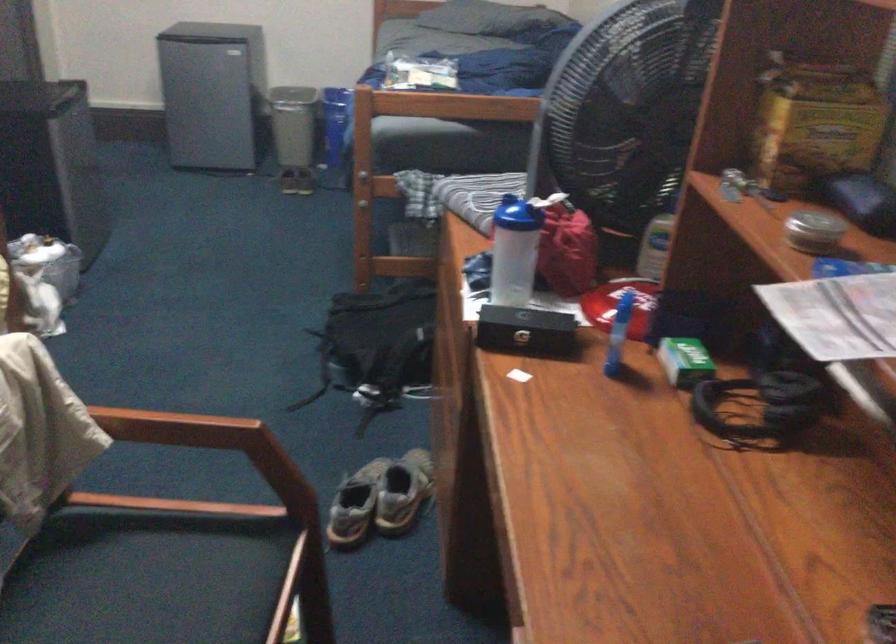
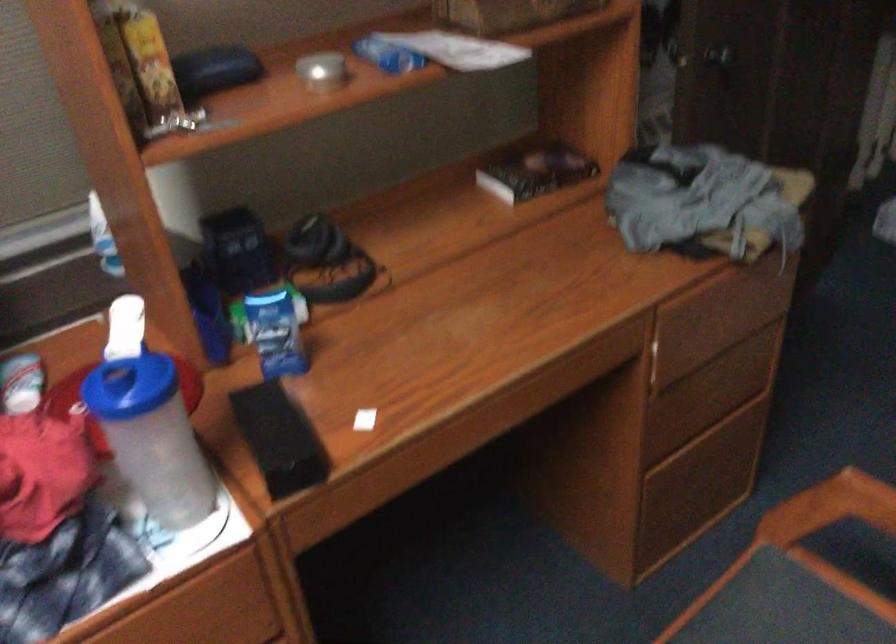
Locate, in the second image, the point that corresponds to the point at 495,207 in the first image.

(130, 386)